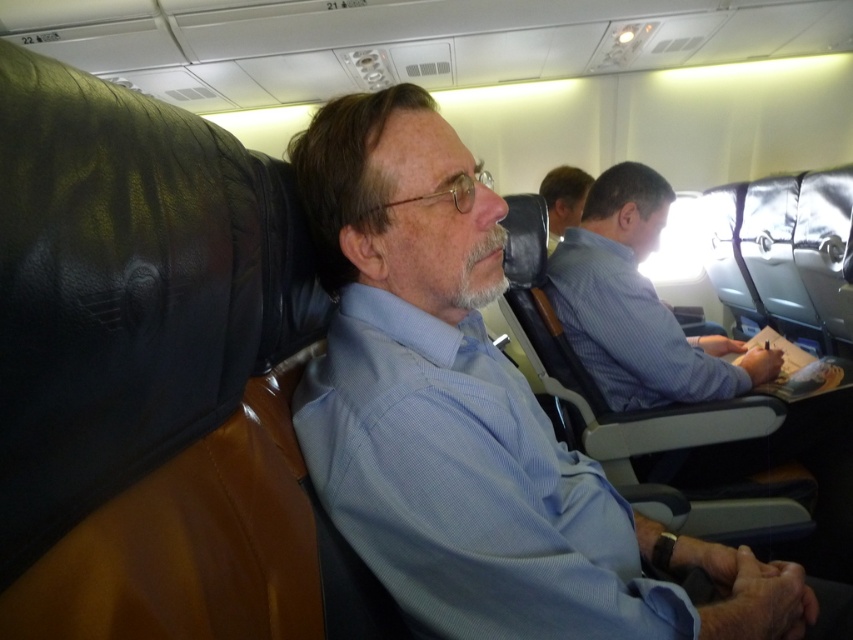
Is the position of blue fabric shirt at center less distant than that of blue textured shirt at center?

No, blue fabric shirt at center is further to the viewer.

Does point (325, 186) come closer to viewer compared to point (352, 417)?

No.

Where is `blue fabric shirt at center`? This screenshot has height=640, width=853. blue fabric shirt at center is located at coordinates (473, 417).

Identify the location of blue fabric shirt at center. This screenshot has width=853, height=640. (473, 417).

Can you confirm if blue textured shirt at center is positioned to the right of light blue shirt at center?

Incorrect, blue textured shirt at center is not on the right side of light blue shirt at center.

Can you confirm if blue textured shirt at center is thinner than light blue shirt at center?

No.

Where is `blue textured shirt at center`? The width and height of the screenshot is (853, 640). blue textured shirt at center is located at coordinates (468, 486).

The width and height of the screenshot is (853, 640). I want to click on blue textured shirt at center, so click(468, 486).

Which is more to the right, blue shirt at center or light blue shirt at center?

Positioned to the right is blue shirt at center.

Does blue shirt at center have a lesser width compared to light blue shirt at center?

In fact, blue shirt at center might be wider than light blue shirt at center.

Which is behind, point (587, 314) or point (550, 212)?

The point (550, 212) is more distant.

Where is `blue shirt at center`? blue shirt at center is located at coordinates (637, 305).